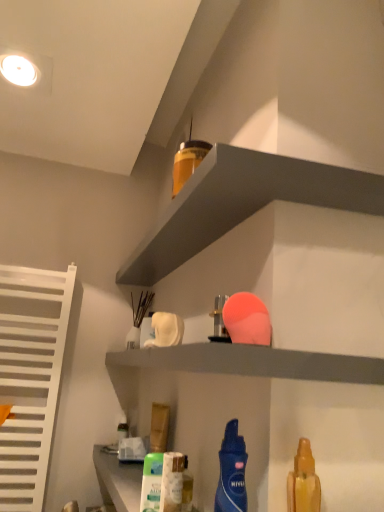
Question: From a real-world perspective, is white matte shelf at upper center, the first shelf positioned from the bottom, on top of matte gray shelf at upper center, which is counted as the 1th shelf, starting from the top?

Choices:
 (A) no
 (B) yes

Answer: (A)

Question: Is white matte shelf at upper center, marked as the 2th shelf in a top-to-bottom arrangement, closer to the viewer compared to matte gray shelf at upper center, which is counted as the 1th shelf, starting from the top?

Choices:
 (A) no
 (B) yes

Answer: (B)

Question: Can you confirm if white matte shelf at upper center, marked as the 2th shelf in a top-to-bottom arrangement, is smaller than matte gray shelf at upper center, which is counted as the 1th shelf, starting from the top?

Choices:
 (A) no
 (B) yes

Answer: (A)

Question: Is white matte shelf at upper center, marked as the 2th shelf in a top-to-bottom arrangement, positioned with its back to matte gray shelf at upper center, positioned as the 2th shelf in bottom-to-top order?

Choices:
 (A) no
 (B) yes

Answer: (A)

Question: Is white matte shelf at upper center, marked as the 2th shelf in a top-to-bottom arrangement, at the right side of matte gray shelf at upper center, positioned as the 2th shelf in bottom-to-top order?

Choices:
 (A) no
 (B) yes

Answer: (A)

Question: In terms of width, does matte gray shelf at upper center, positioned as the 2th shelf in bottom-to-top order, look wider or thinner when compared to translucent plastic spray bottle at center, which ranks as the second cleaning product in back-to-front order?

Choices:
 (A) wide
 (B) thin

Answer: (A)

Question: Choose the correct answer: Is matte gray shelf at upper center, positioned as the 2th shelf in bottom-to-top order, inside translucent plastic spray bottle at center, the 1th cleaning product in the left-to-right sequence, or outside it?

Choices:
 (A) outside
 (B) inside

Answer: (A)

Question: From a real-world perspective, is matte gray shelf at upper center, positioned as the 2th shelf in bottom-to-top order, positioned above or below translucent plastic spray bottle at center, acting as the third cleaning product starting from the front?

Choices:
 (A) below
 (B) above

Answer: (B)

Question: Considering their positions, is matte gray shelf at upper center, which is counted as the 1th shelf, starting from the top, located in front of or behind translucent plastic spray bottle at center, the 1th cleaning product in the left-to-right sequence?

Choices:
 (A) front
 (B) behind

Answer: (A)

Question: In terms of width, does translucent yellow spray bottle at lower right, the fourth cleaning product in the back-to-front sequence, look wider or thinner when compared to translucent plastic spray bottle at center, acting as the third cleaning product starting from the front?

Choices:
 (A) thin
 (B) wide

Answer: (B)

Question: In terms of height, does translucent yellow spray bottle at lower right, the fourth cleaning product in the back-to-front sequence, look taller or shorter compared to translucent plastic spray bottle at center, which ranks as the second cleaning product in back-to-front order?

Choices:
 (A) tall
 (B) short

Answer: (A)

Question: Considering the positions of point coord(292,485) and point coord(165,485), is point coord(292,485) closer or farther from the camera than point coord(165,485)?

Choices:
 (A) farther
 (B) closer

Answer: (B)

Question: From the image's perspective, is translucent yellow spray bottle at lower right, which ranks as the 1th cleaning product in right-to-left order, above or below translucent plastic spray bottle at center, the first cleaning product when ordered from bottom to top?

Choices:
 (A) above
 (B) below

Answer: (A)

Question: From the image's perspective, is blue matte lotion at center, the 3th cleaning product from the back, above or below translucent plastic spray bottle at center, acting as the 4th cleaning product starting from the right?

Choices:
 (A) below
 (B) above

Answer: (B)

Question: Is point (228, 479) closer or farther from the camera than point (167, 502)?

Choices:
 (A) closer
 (B) farther

Answer: (A)